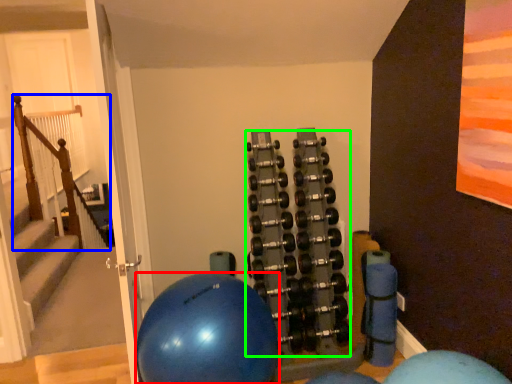
Question: Which object is positioned farthest from ball (highlighted by a red box)? Select from rail (highlighted by a blue box) and dumbbell (highlighted by a green box).

Choices:
 (A) rail
 (B) dumbbell

Answer: (A)